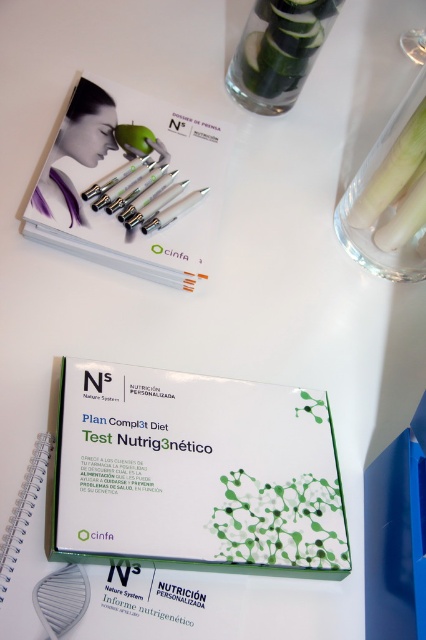
Who is taller, white matte box at center or clear glass vase at upper right?

white matte box at center

Can you confirm if white matte box at center is thinner than clear glass vase at upper right?

Incorrect, white matte box at center's width is not less than clear glass vase at upper right's.

Identify the location of white matte box at center. (195, 472).

Is clear glass vase at upper right to the right of transparent glass vase at upper right from the viewer's perspective?

No, clear glass vase at upper right is not to the right of transparent glass vase at upper right.

Between clear glass vase at upper right and transparent glass vase at upper right, which one appears on the right side from the viewer's perspective?

From the viewer's perspective, transparent glass vase at upper right appears more on the right side.

Locate an element on the screen. This screenshot has height=640, width=426. clear glass vase at upper right is located at coordinates (278, 51).

Can you confirm if white matte pen at upper center is positioned to the right of transparent glass vase at upper right?

In fact, white matte pen at upper center is to the left of transparent glass vase at upper right.

Describe the element at coordinates (132, 186) in the screenshot. The height and width of the screenshot is (640, 426). I see `white matte pen at upper center` at that location.

In order to click on white matte pen at upper center in this screenshot , I will do `click(132, 186)`.